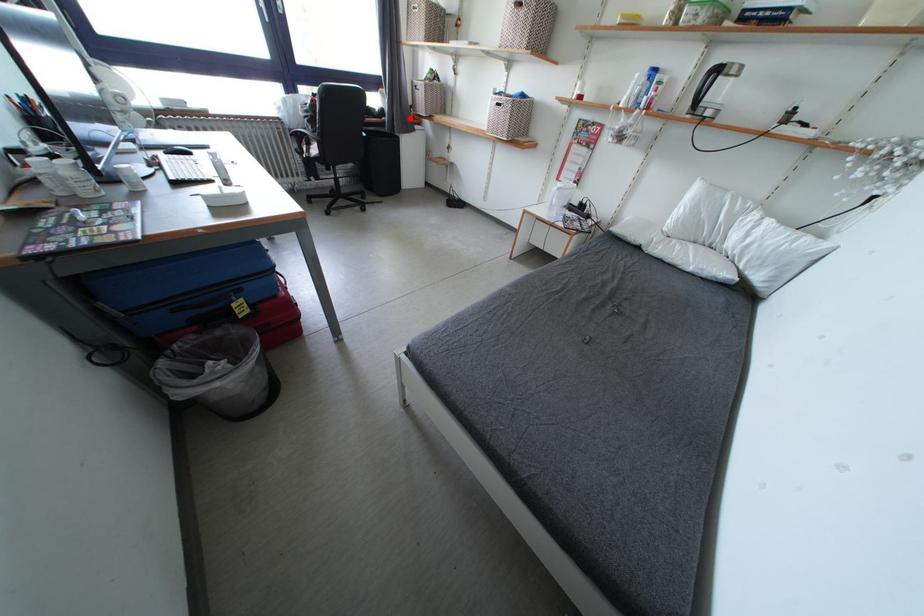
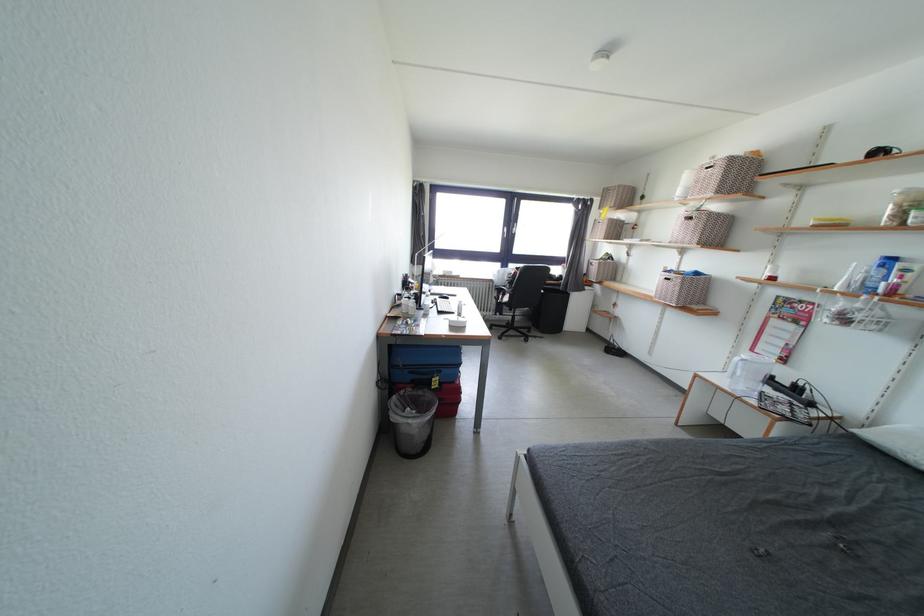
In the second image, find the point that corresponds to the highlighted location in the first image.

(584, 284)